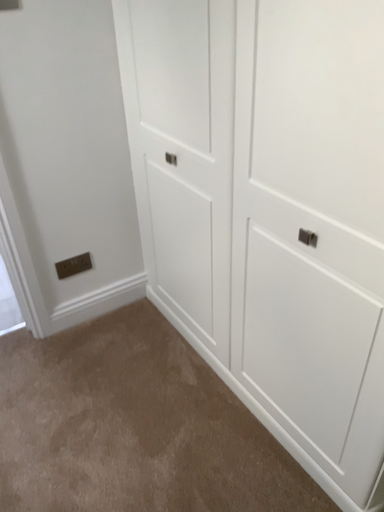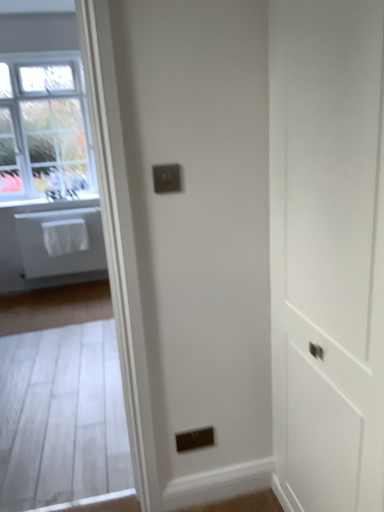
Question: Which way did the camera rotate in the video?

Choices:
 (A) rotated right
 (B) rotated left

Answer: (B)